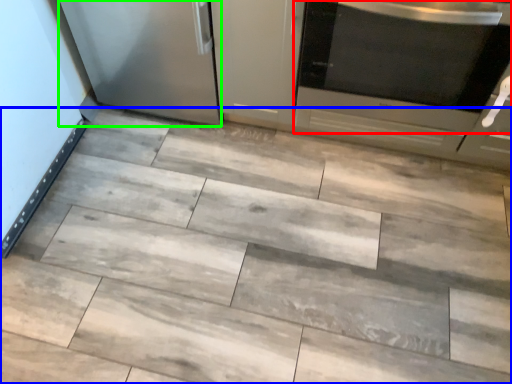
Question: Considering the real-world distances, which object is farthest from home appliance (highlighted by a red box)? ceramic tile (highlighted by a blue box) or appliance (highlighted by a green box)?

Choices:
 (A) ceramic tile
 (B) appliance

Answer: (B)